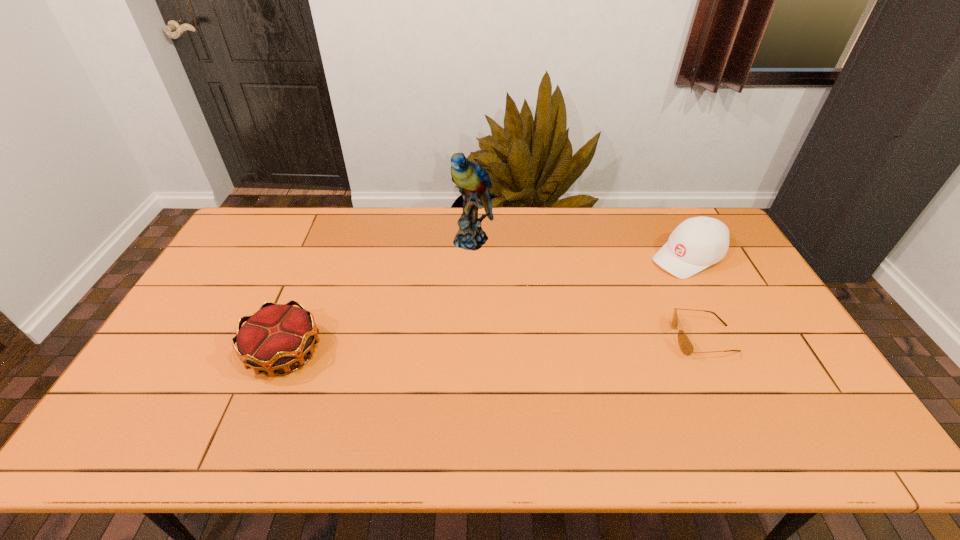
Locate an element on the screen. This screenshot has width=960, height=540. baseball cap positioned at the right edge is located at coordinates (699, 242).

Where is `object situated at the far right corner`? object situated at the far right corner is located at coordinates (699, 242).

Locate an element on the screen. vacant region at the far edge of the desktop is located at coordinates (503, 212).

Image resolution: width=960 pixels, height=540 pixels. I want to click on free space at the near edge, so tap(291, 387).

This screenshot has width=960, height=540. In the image, there is a desktop. Identify the location of blank space at the right edge. [746, 309].

Find the location of a particular element. This screenshot has height=540, width=960. free space at the far left corner of the desktop is located at coordinates (284, 210).

At what (x,y) coordinates should I click in order to perform the action: click on free region at the near left corner of the desktop. Please return your answer as a coordinate pair (x, y). Looking at the image, I should click on (177, 381).

The height and width of the screenshot is (540, 960). Identify the location of free space that is in between the shortest object and the leftmost object. (494, 346).

Locate an element on the screen. The image size is (960, 540). unoccupied position between the tallest object and the crown is located at coordinates (379, 296).

Find the location of a particular element. The height and width of the screenshot is (540, 960). free space between the second tallest object and the second shortest object is located at coordinates (486, 305).